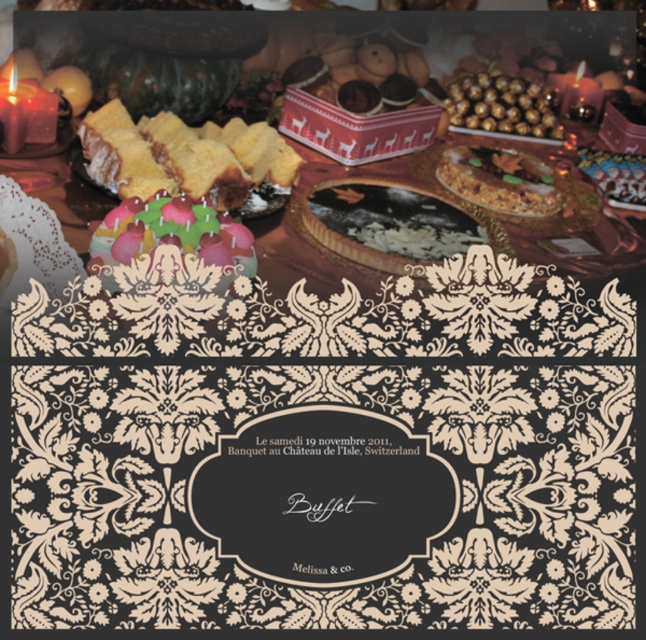
You are at the center of the image and want to move towards the point marked at coordinates (182, 156). What object will you encounter first?

The point at coordinates (182, 156) is located on the spongy golden cake at center, so you will encounter the spongy golden cake at center first.